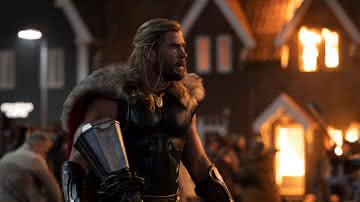
This screenshot has height=202, width=360. I want to click on windows, so click(x=338, y=137), click(x=351, y=129), click(x=52, y=70), click(x=5, y=61), click(x=200, y=54), click(x=222, y=54), click(x=311, y=57), click(x=329, y=51), click(x=284, y=52), click(x=209, y=135).